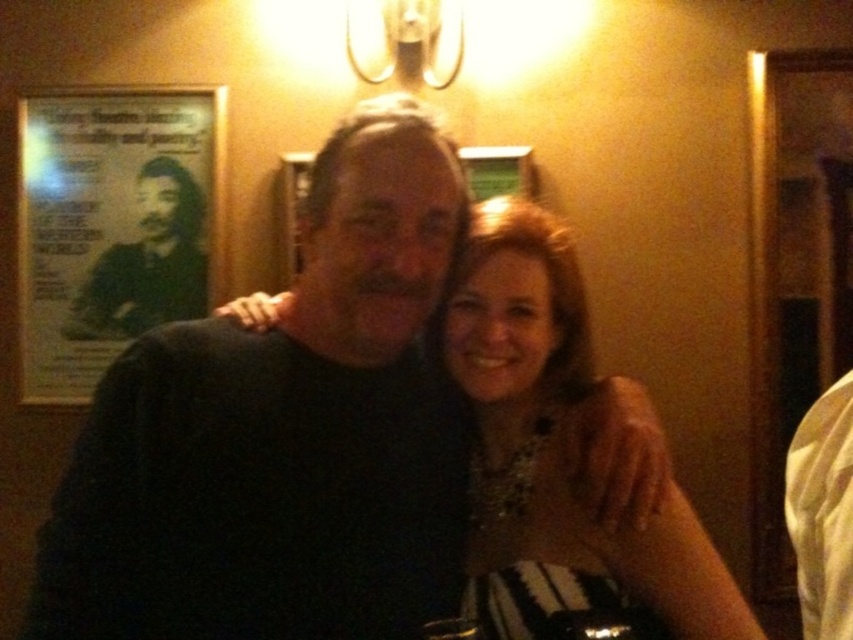
Is black matte shirt at center taller than shiny silver necklace at center?

Correct, black matte shirt at center is much taller as shiny silver necklace at center.

Which is behind, point (239, 550) or point (647, 572)?

Positioned behind is point (647, 572).

Where is `black matte shirt at center`? black matte shirt at center is located at coordinates (283, 433).

Does shiny silver necklace at center come in front of green matte poster at upper left?

Yes, it is in front of green matte poster at upper left.

Is point (596, 547) farther from camera compared to point (201, 298)?

No, (596, 547) is in front of (201, 298).

At what (x,y) coordinates should I click in order to perform the action: click on shiny silver necklace at center. Please return your answer as a coordinate pair (x, y). Looking at the image, I should click on [x=556, y=452].

Is point (347, 608) positioned before point (111, 291)?

That is True.

Between black matte shirt at center and green matte poster at upper left, which one is positioned lower?

Positioned lower is black matte shirt at center.

Is point (355, 317) positioned after point (90, 320)?

That is False.

Find the location of a particular element. The height and width of the screenshot is (640, 853). black matte shirt at center is located at coordinates (283, 433).